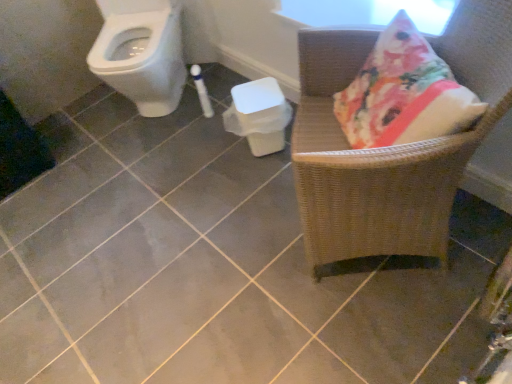
Question: Is woven wood chair at right taller than white plastic potty at center?

Choices:
 (A) no
 (B) yes

Answer: (B)

Question: From a real-world perspective, does woven wood chair at right stand above white plastic potty at center?

Choices:
 (A) yes
 (B) no

Answer: (A)

Question: Can you see woven wood chair at right touching white plastic potty at center?

Choices:
 (A) yes
 (B) no

Answer: (B)

Question: Is woven wood chair at right positioned before white plastic potty at center?

Choices:
 (A) yes
 (B) no

Answer: (A)

Question: Is woven wood chair at right wider than white plastic potty at center?

Choices:
 (A) no
 (B) yes

Answer: (B)

Question: Considering the positions of white plastic potty at center and woven wood chair at right in the image, is white plastic potty at center taller or shorter than woven wood chair at right?

Choices:
 (A) tall
 (B) short

Answer: (B)

Question: Is point [247, 127] positioned closer to the camera than point [301, 82]?

Choices:
 (A) farther
 (B) closer

Answer: (A)

Question: Considering the positions of white plastic potty at center and woven wood chair at right in the image, is white plastic potty at center wider or thinner than woven wood chair at right?

Choices:
 (A) wide
 (B) thin

Answer: (B)

Question: From a real-world perspective, is white plastic potty at center physically located above or below woven wood chair at right?

Choices:
 (A) above
 (B) below

Answer: (B)

Question: Considering the positions of white glossy toilet at upper left and woven wood chair at right in the image, is white glossy toilet at upper left bigger or smaller than woven wood chair at right?

Choices:
 (A) small
 (B) big

Answer: (A)

Question: Considering the positions of white glossy toilet at upper left and woven wood chair at right in the image, is white glossy toilet at upper left wider or thinner than woven wood chair at right?

Choices:
 (A) thin
 (B) wide

Answer: (B)

Question: From the image's perspective, is white glossy toilet at upper left located above or below woven wood chair at right?

Choices:
 (A) below
 (B) above

Answer: (B)

Question: Considering the relative positions of white glossy toilet at upper left and woven wood chair at right in the image provided, is white glossy toilet at upper left to the left or to the right of woven wood chair at right?

Choices:
 (A) left
 (B) right

Answer: (A)

Question: Considering the relative positions of woven wood chair at right and white plastic potty at center in the image provided, is woven wood chair at right to the left or to the right of white plastic potty at center?

Choices:
 (A) left
 (B) right

Answer: (B)

Question: Which is correct: woven wood chair at right is inside white plastic potty at center, or outside of it?

Choices:
 (A) outside
 (B) inside

Answer: (A)